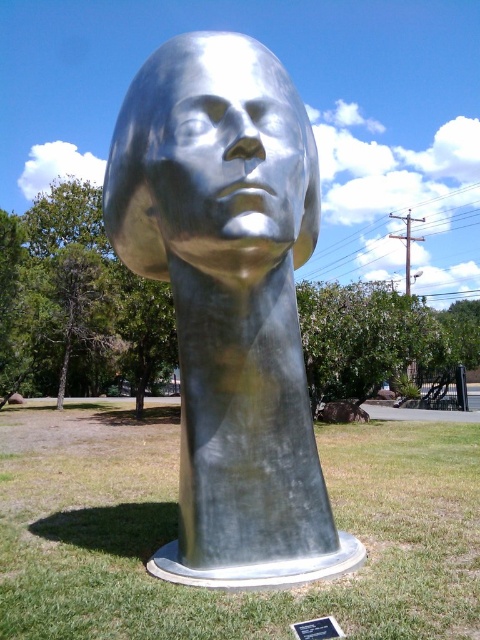
You are standing at point [170,228] and want to walk to the sculpture. Is point [456,515] behind you or in front of you?

Point [456,515] is behind point [170,228], so it is behind you.

You are standing in front of the sculpture and want to place a small flower pot on the ground between the green grass at center and the shiny metallic face at center. Is there enough space to place it there?

The green grass at center is to the left of the shiny metallic face at center, so there is space between them to place the flower pot.

You are a visitor at an outdoor art exhibit and notice the shiny metallic face at center and the black metal plaque at center. According to their positions, which object is located to the right?

The black metal plaque at center is located to the right of the shiny metallic face at center.